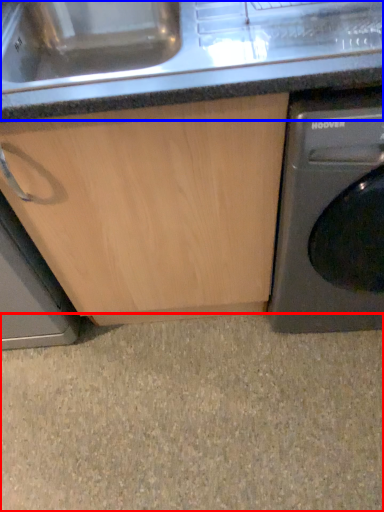
Question: Which of the following is the closest to the observer, granite (highlighted by a red box) or counter top (highlighted by a blue box)?

Choices:
 (A) granite
 (B) counter top

Answer: (B)